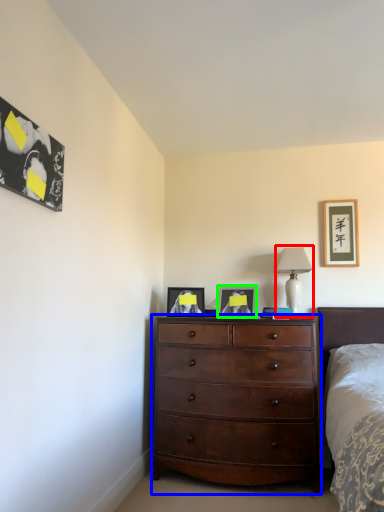
Question: Which object is the closest to the table lamp (highlighted by a red box)? Choose among these: chest of drawers (highlighted by a blue box) or picture frame (highlighted by a green box).

Choices:
 (A) chest of drawers
 (B) picture frame

Answer: (B)